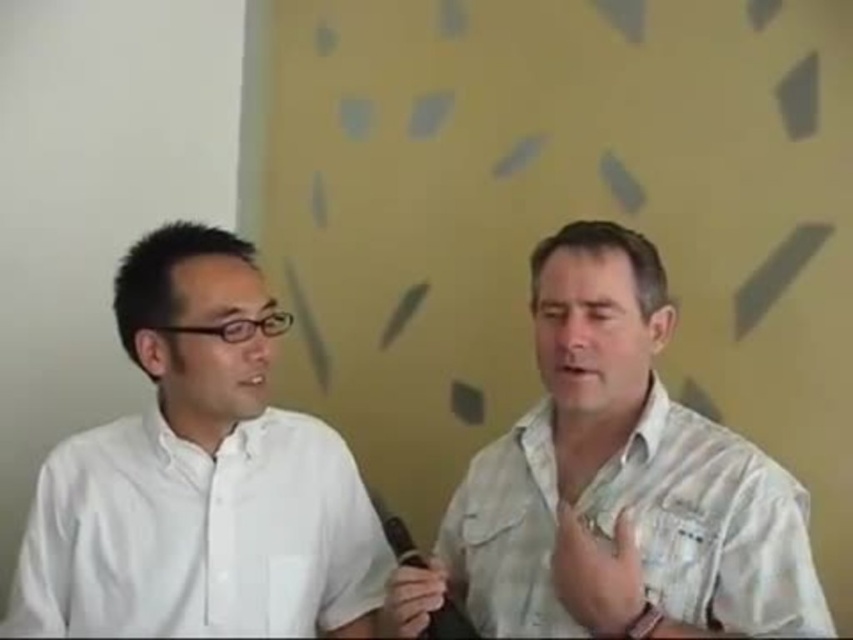
You are a tailor who needs to determine which shirt requires more fabric between the white textured shirt at center and the white smooth shirt at left. Based on their sizes, which one would you choose?

The white textured shirt at center is bigger than the white smooth shirt at left, so it would require more fabric.